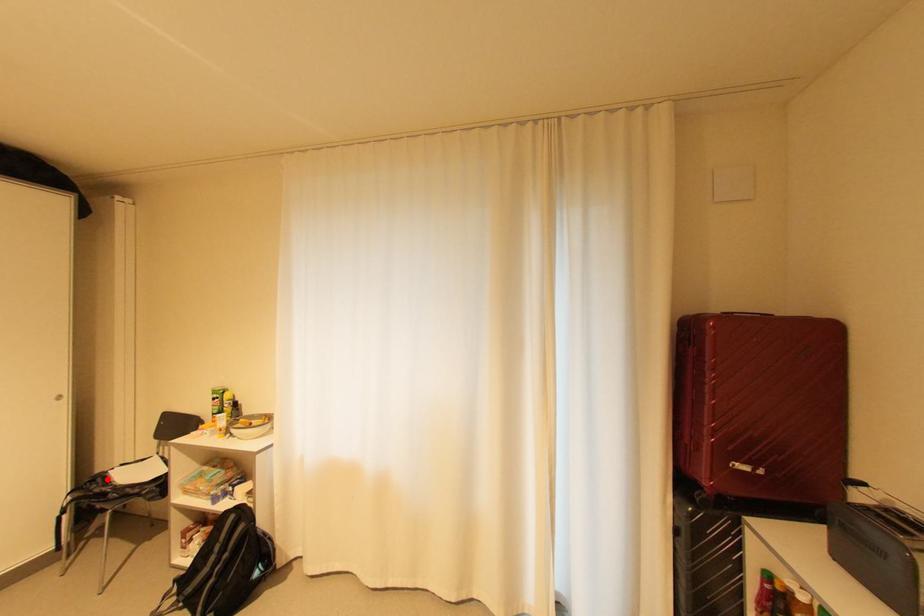
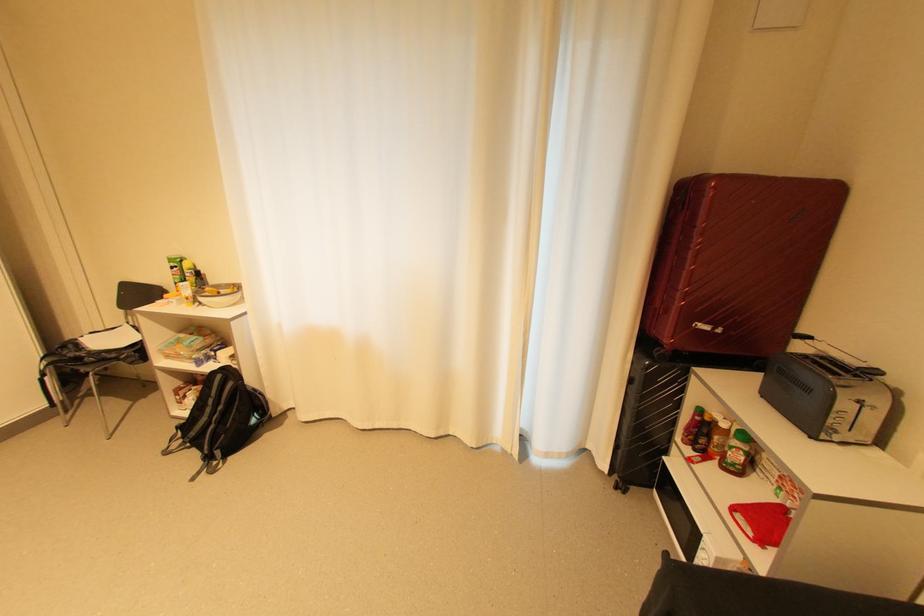
Question: I am providing you with two images of the same scene from different viewpoints. In image1, a red point is highlighted. Considering the same 3D point in image2, which of the following is correct?

Choices:
 (A) It is closer
 (B) It is farther

Answer: (B)